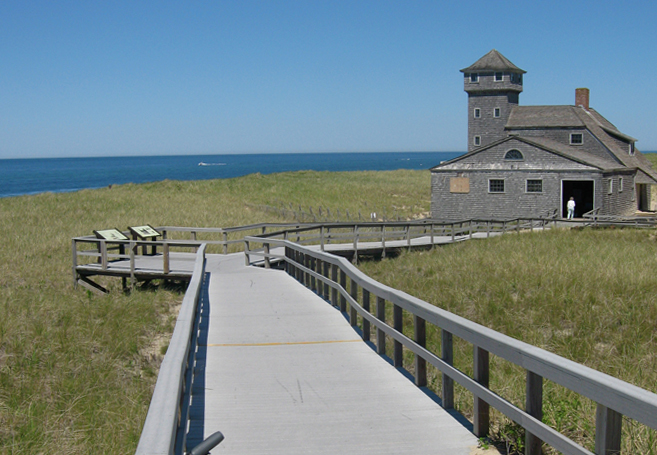
This screenshot has width=657, height=455. Find the location of `chimney`. chimney is located at coordinates (583, 97).